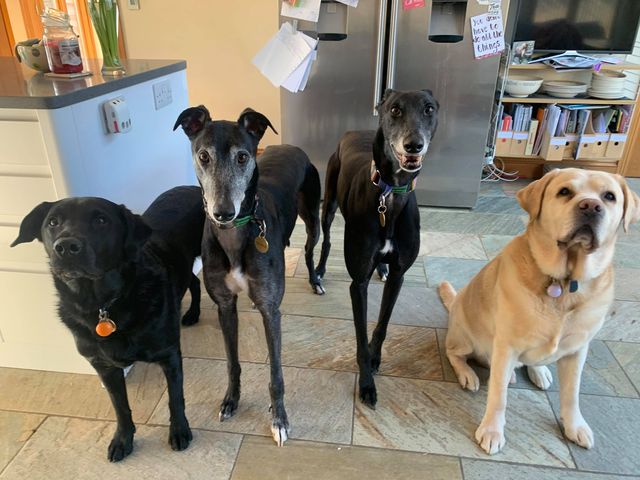
Where is `fridge`? The image size is (640, 480). fridge is located at coordinates (468, 92).